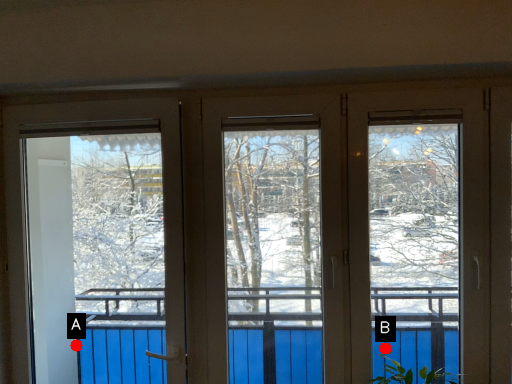
Question: Two points are circled on the image, labeled by A and B beside each circle. Which point is closer to the camera?

Choices:
 (A) A is closer
 (B) B is closer

Answer: (B)